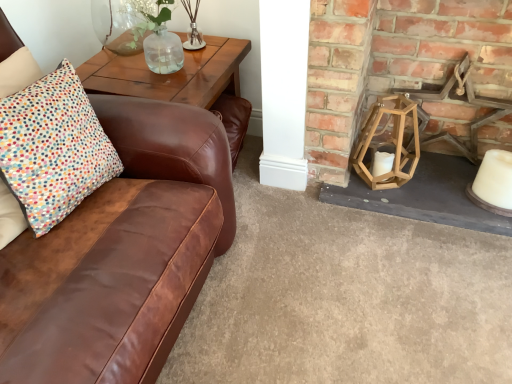
Question: Are wooden hexagonal lantern at right, the first candle holder from the right, and clear glass vase at upper center, marked as the 1th candle holder in a top-to-bottom arrangement, located far from each other?

Choices:
 (A) yes
 (B) no

Answer: (B)

Question: Is wooden hexagonal lantern at right, which ranks as the second candle holder in top-to-bottom order, placed right next to clear glass vase at upper center, the first candle holder viewed from the left?

Choices:
 (A) yes
 (B) no

Answer: (B)

Question: From the image's perspective, is wooden hexagonal lantern at right, which is counted as the 1th candle holder, starting from the bottom, below clear glass vase at upper center, acting as the 2th candle holder starting from the right?

Choices:
 (A) no
 (B) yes

Answer: (B)

Question: From a real-world perspective, is wooden hexagonal lantern at right, the first candle holder from the right, on top of clear glass vase at upper center, the first candle holder viewed from the left?

Choices:
 (A) no
 (B) yes

Answer: (A)

Question: Is wooden hexagonal lantern at right, which is counted as the 1th candle holder, starting from the bottom, facing towards clear glass vase at upper center, the first candle holder viewed from the left?

Choices:
 (A) yes
 (B) no

Answer: (B)

Question: Is wooden hexagonal lantern at right, which is counted as the 1th candle holder, starting from the bottom, positioned beyond the bounds of clear glass vase at upper center, arranged as the second candle holder when ordered from the bottom?

Choices:
 (A) yes
 (B) no

Answer: (A)

Question: Considering the relative sizes of wooden lantern at right and wooden table at upper left in the image provided, is wooden lantern at right shorter than wooden table at upper left?

Choices:
 (A) yes
 (B) no

Answer: (B)

Question: Is wooden lantern at right looking in the opposite direction of wooden table at upper left?

Choices:
 (A) no
 (B) yes

Answer: (A)

Question: Can you confirm if wooden lantern at right is thinner than wooden table at upper left?

Choices:
 (A) yes
 (B) no

Answer: (A)

Question: From the image's perspective, is wooden lantern at right below wooden table at upper left?

Choices:
 (A) yes
 (B) no

Answer: (B)

Question: Can you confirm if wooden lantern at right is positioned to the left of wooden table at upper left?

Choices:
 (A) yes
 (B) no

Answer: (B)

Question: Considering the relative positions of wooden lantern at right and wooden table at upper left in the image provided, is wooden lantern at right behind wooden table at upper left?

Choices:
 (A) no
 (B) yes

Answer: (A)

Question: Is wooden hexagonal lantern at right, which is counted as the 1th candle holder, starting from the bottom, not inside white matte candle at lower right?

Choices:
 (A) yes
 (B) no

Answer: (A)